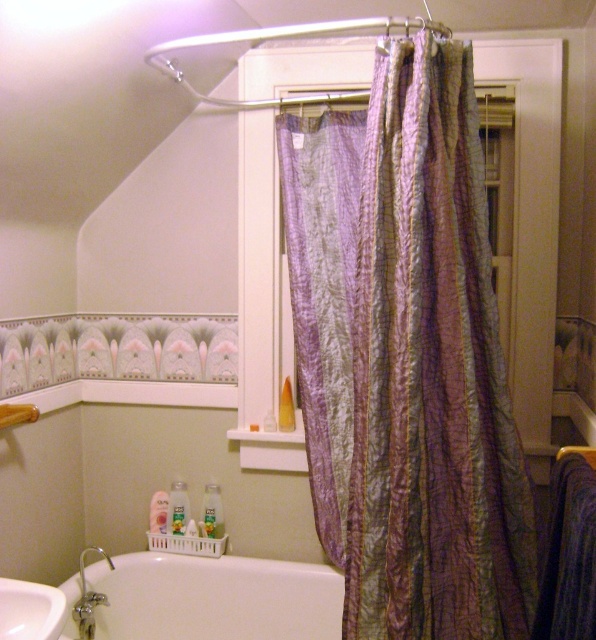
Question: Can you confirm if white glossy bathtub at lower left is wider than silver metallic faucet at lower left?

Choices:
 (A) yes
 (B) no

Answer: (A)

Question: Is silver metallic faucet at lower left above wooden towel bar at lower left?

Choices:
 (A) no
 (B) yes

Answer: (A)

Question: Which of the following is the farthest from the observer?

Choices:
 (A) (215, 577)
 (B) (36, 632)
 (C) (27, 412)

Answer: (A)

Question: Among these objects, which one is nearest to the camera?

Choices:
 (A) white glossy bathtub at lower left
 (B) white glossy sink at lower left
 (C) purple textured fabric at center
 (D) wooden towel bar at lower left

Answer: (B)

Question: Which point is farther to the camera?

Choices:
 (A) purple textured fabric at center
 (B) silver metallic faucet at lower left

Answer: (B)

Question: Considering the relative positions of purple textured fabric at center and wooden towel bar at lower left in the image provided, where is purple textured fabric at center located with respect to wooden towel bar at lower left?

Choices:
 (A) below
 (B) above

Answer: (B)